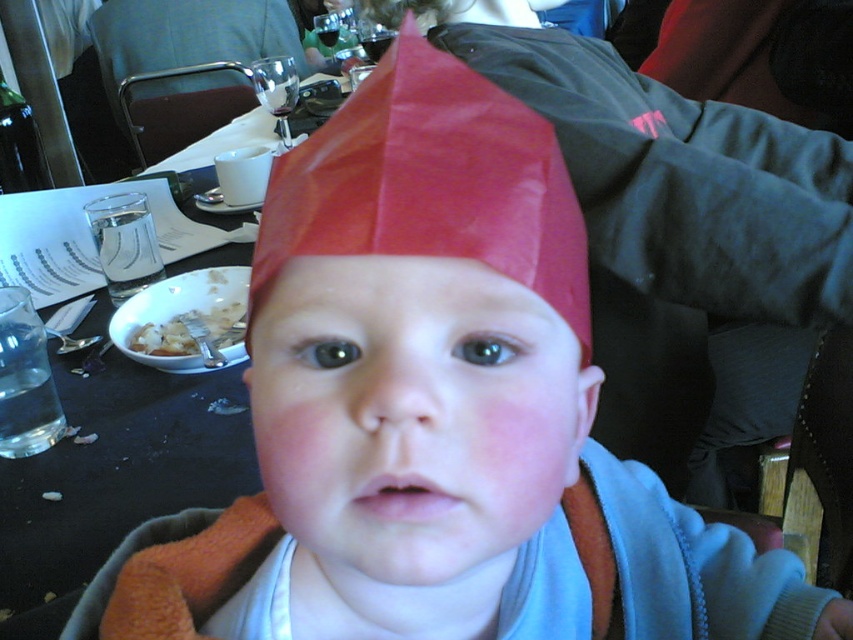
Can you confirm if red paper hat at center is positioned to the left of white crumbly food at lower left?

Incorrect, red paper hat at center is not on the left side of white crumbly food at lower left.

Does red paper hat at center come in front of white crumbly food at lower left?

Yes, it is.

Is point (503, 145) farther from viewer compared to point (189, 330)?

No, it is in front of (189, 330).

You are a GUI agent. You are given a task and a screenshot of the screen. Output one action in this format:
    pyautogui.click(x=<x>, y=<y>)
    Task: Click on the red paper hat at center
    Image resolution: width=853 pixels, height=640 pixels.
    Given the screenshot: What is the action you would take?
    pyautogui.click(x=430, y=182)